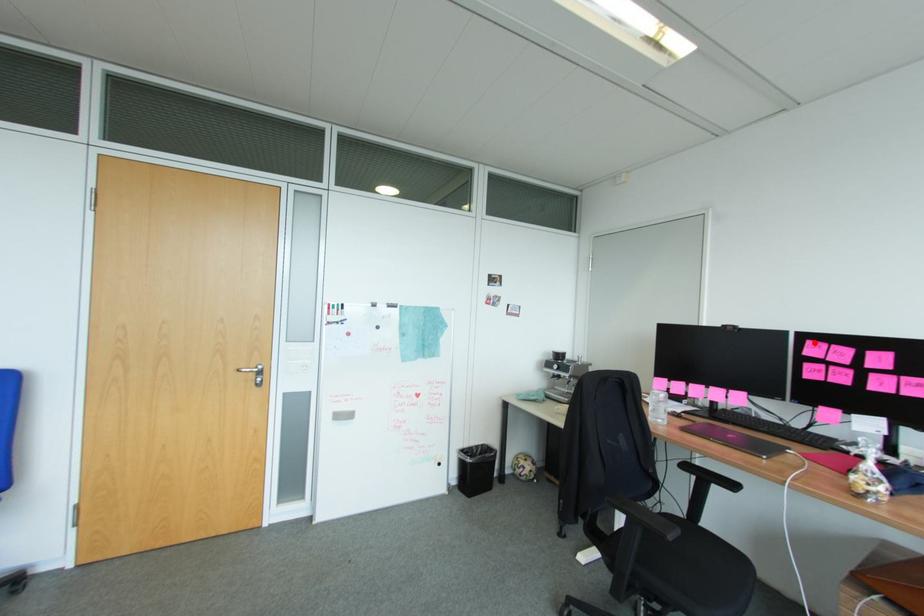
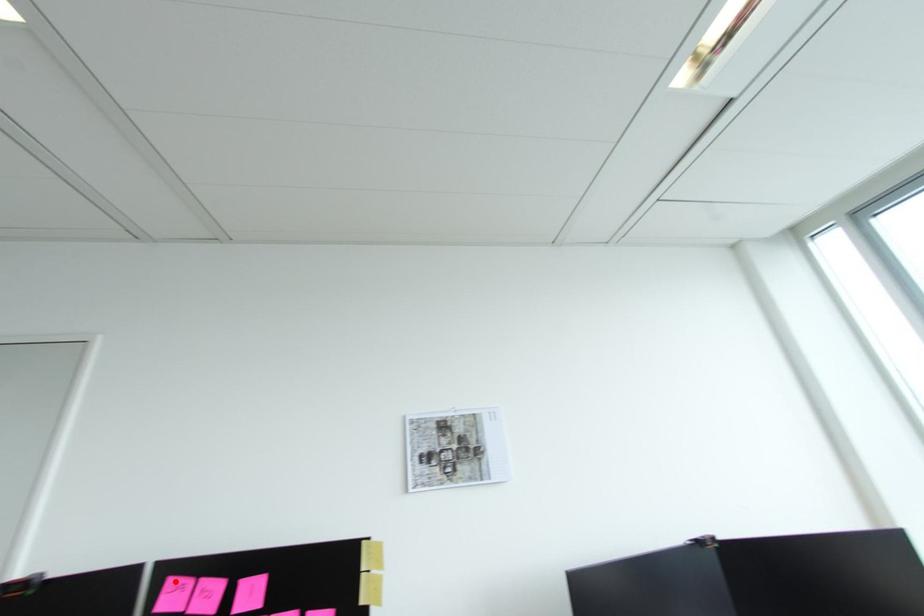
I am providing you with two images of the same scene from different viewpoints. A red point is marked on the first image and another point is marked on the second image. Are the points marked in image1 and image2 representing the same 3D position?

Yes